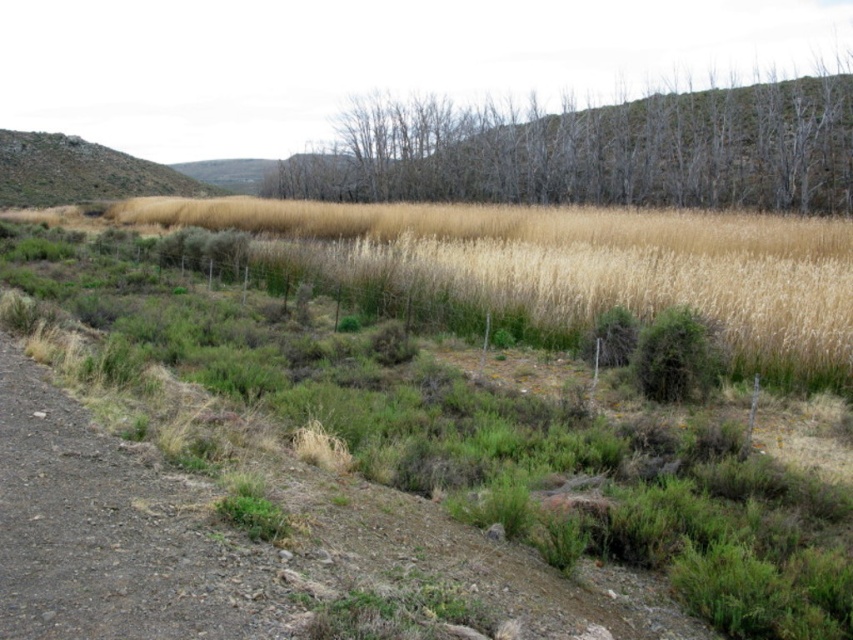
Question: Is dry grass at center to the right of bare wood trees at center from the viewer's perspective?

Choices:
 (A) no
 (B) yes

Answer: (A)

Question: Can you confirm if dry grass at center is positioned below rugged brown hillside at upper left?

Choices:
 (A) no
 (B) yes

Answer: (B)

Question: Among these objects, which one is farthest from the camera?

Choices:
 (A) dry grass at center
 (B) bare wood trees at center

Answer: (B)

Question: Which object is the closest to the dry grass at center?

Choices:
 (A) rugged brown hillside at upper left
 (B) bare wood trees at center

Answer: (B)

Question: Is dry grass at center to the right of rugged brown hillside at upper left from the viewer's perspective?

Choices:
 (A) no
 (B) yes

Answer: (B)

Question: Which object is positioned closest to the rugged brown hillside at upper left?

Choices:
 (A) dry grass at center
 (B) bare wood trees at center

Answer: (B)